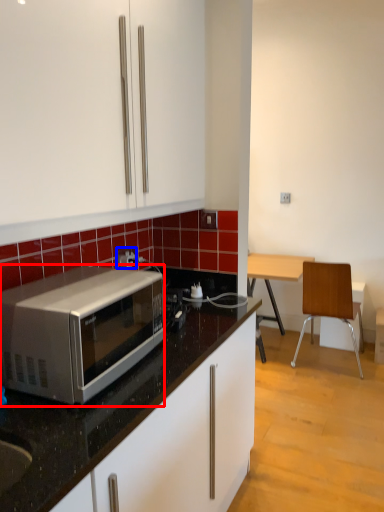
Question: Which object is further to the camera taking this photo, microwave oven (highlighted by a red box) or power outlet (highlighted by a blue box)?

Choices:
 (A) microwave oven
 (B) power outlet

Answer: (B)